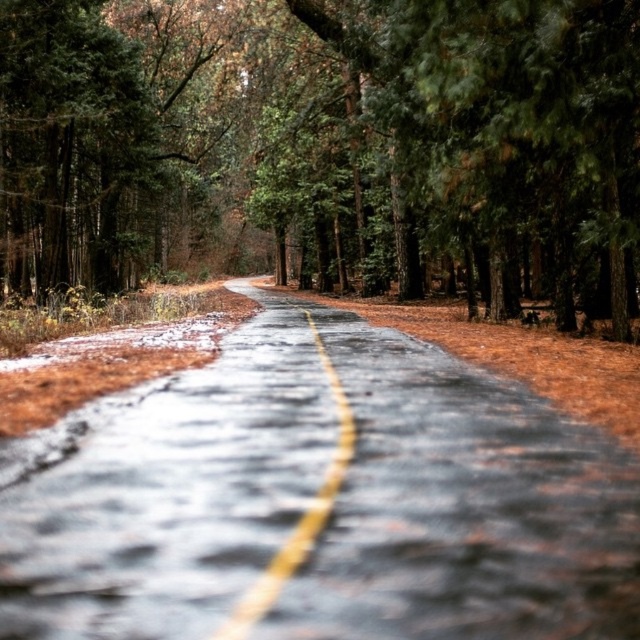
You are driving a car that is 2 meters wide. You come across a narrow bridge ahead on the glossy asphalt road at center. The bridge can only accommodate vehicles up to 2.5 meters wide. Can your car safely cross the bridge if the yellow matte line at center is in the middle of the road?

The glossy asphalt road at center is wider than the yellow matte line at center, but the exact width of the road isn not specified. However, since the bridge allows vehicles up to 2.5 meters and your car is 2 meters, it should fit as long as the road is at least 2.5 meters wide. The information provided doesn not confirm the road width, so it is uncertain.

In the scene shown: You are a drone operator trying to capture the glossy asphalt road at center in your camera frame. The road is divided into two lanes by a yellow line. Your drone is currently positioned at the point with coordinates (317, 499). Can you confirm if this point is located on the glossy asphalt road at center?

Yes, the point at coordinates (317, 499) is located on the glossy asphalt road at center, as indicated by the Objects Description.

You are a driver approaching the glossy asphalt road at center and the yellow matte line at center. Which object will appear larger in your view as you drive closer?

The glossy asphalt road at center will appear larger in your view than the yellow matte line at center as you drive closer because it is much taller according to the description.